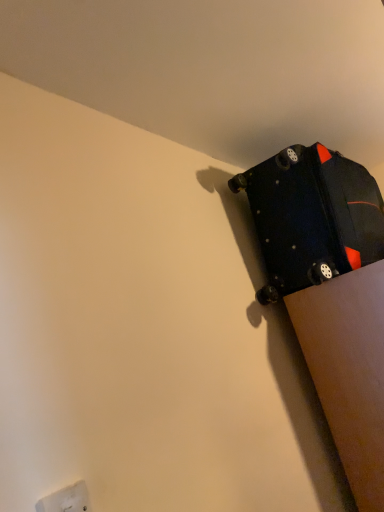
Image resolution: width=384 pixels, height=512 pixels. What are the coordinates of `white plastic electric outlet at lower left` in the screenshot? It's located at (66, 500).

What do you see at coordinates (66, 500) in the screenshot?
I see `white plastic electric outlet at lower left` at bounding box center [66, 500].

In order to face white plastic electric outlet at lower left, should I rotate leftwards or rightwards?

It's best to rotate left around 16.422 degrees.

What do you see at coordinates (312, 217) in the screenshot? I see `matte black suitcase at upper right` at bounding box center [312, 217].

Locate an element on the screen. This screenshot has height=512, width=384. matte black suitcase at upper right is located at coordinates (312, 217).

What are the coordinates of `white plastic electric outlet at lower left` in the screenshot? It's located at (66, 500).

Between white plastic electric outlet at lower left and matte black suitcase at upper right, which one appears on the right side from the viewer's perspective?

Positioned to the right is matte black suitcase at upper right.

Is the depth of white plastic electric outlet at lower left less than that of matte black suitcase at upper right?

Yes.

Does point (47, 511) come behind point (347, 238)?

No, it is in front of (347, 238).

From the image's perspective, who appears lower, white plastic electric outlet at lower left or matte black suitcase at upper right?

white plastic electric outlet at lower left appears lower in the image.

From a real-world perspective, is white plastic electric outlet at lower left on matte black suitcase at upper right?

Incorrect, from a real-world perspective, white plastic electric outlet at lower left is lower than matte black suitcase at upper right.

Considering the sizes of objects white plastic electric outlet at lower left and matte black suitcase at upper right in the image provided, who is wider, white plastic electric outlet at lower left or matte black suitcase at upper right?

matte black suitcase at upper right is wider.

Who is taller, white plastic electric outlet at lower left or matte black suitcase at upper right?

With more height is matte black suitcase at upper right.

Between white plastic electric outlet at lower left and matte black suitcase at upper right, which one has larger size?

Bigger between the two is matte black suitcase at upper right.

Is matte black suitcase at upper right located within white plastic electric outlet at lower left?

No, white plastic electric outlet at lower left does not contain matte black suitcase at upper right.

Would you consider white plastic electric outlet at lower left to be distant from matte black suitcase at upper right?

Yes.

Is white plastic electric outlet at lower left aimed at matte black suitcase at upper right?

No, white plastic electric outlet at lower left is not facing towards matte black suitcase at upper right.

At what (x,y) coordinates should I click in order to perform the action: click on luggage and bags that appears above the white plastic electric outlet at lower left (from a real-world perspective). Please return your answer as a coordinate pair (x, y). The image size is (384, 512). Looking at the image, I should click on (312, 217).

Is matte black suitcase at upper right to the left of white plastic electric outlet at lower left from the viewer's perspective?

No.

Considering their positions, is matte black suitcase at upper right located in front of or behind white plastic electric outlet at lower left?

Clearly, matte black suitcase at upper right is behind white plastic electric outlet at lower left.

Is point (282, 275) farther from camera compared to point (67, 503)?

Yes, it is.

From the image's perspective, which object appears higher, matte black suitcase at upper right or white plastic electric outlet at lower left?

From the image's view, matte black suitcase at upper right is above.

From a real-world perspective, which is physically below, matte black suitcase at upper right or white plastic electric outlet at lower left?

white plastic electric outlet at lower left is physically lower.

Is matte black suitcase at upper right thinner than white plastic electric outlet at lower left?

Incorrect, the width of matte black suitcase at upper right is not less than that of white plastic electric outlet at lower left.

In terms of height, does matte black suitcase at upper right look taller or shorter compared to white plastic electric outlet at lower left?

Considering their sizes, matte black suitcase at upper right has more height than white plastic electric outlet at lower left.

Looking at the image, does matte black suitcase at upper right seem bigger or smaller compared to white plastic electric outlet at lower left?

matte black suitcase at upper right is bigger than white plastic electric outlet at lower left.

Is white plastic electric outlet at lower left inside matte black suitcase at upper right?

No, white plastic electric outlet at lower left is not a part of matte black suitcase at upper right.

Are matte black suitcase at upper right and white plastic electric outlet at lower left beside each other?

matte black suitcase at upper right and white plastic electric outlet at lower left are not in contact.

Is matte black suitcase at upper right looking in the opposite direction of white plastic electric outlet at lower left?

No, white plastic electric outlet at lower left is not at the back of matte black suitcase at upper right.

How many degrees apart are the facing directions of matte black suitcase at upper right and white plastic electric outlet at lower left?

There is a 3.02-degree angle between the facing directions of matte black suitcase at upper right and white plastic electric outlet at lower left.

You are a GUI agent. You are given a task and a screenshot of the screen. Output one action in this format:
    pyautogui.click(x=<x>, y=<y>)
    Task: Click on the luggage and bags above the white plastic electric outlet at lower left (from the image's perspective)
    
    Given the screenshot: What is the action you would take?
    pyautogui.click(x=312, y=217)

This screenshot has height=512, width=384. Identify the location of luggage and bags located above the white plastic electric outlet at lower left (from a real-world perspective). (312, 217).

Find the location of a particular element. The height and width of the screenshot is (512, 384). luggage and bags behind the white plastic electric outlet at lower left is located at coordinates (312, 217).